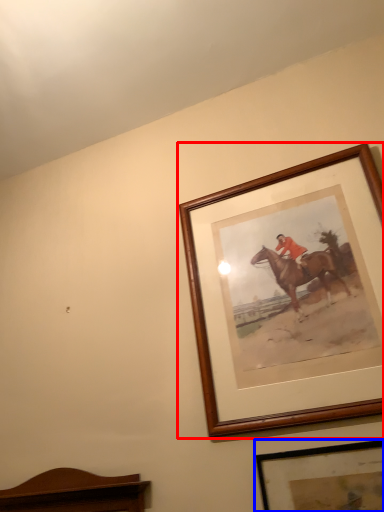
Question: Which of the following is the closest to the observer, picture frame (highlighted by a red box) or picture frame (highlighted by a blue box)?

Choices:
 (A) picture frame
 (B) picture frame

Answer: (B)